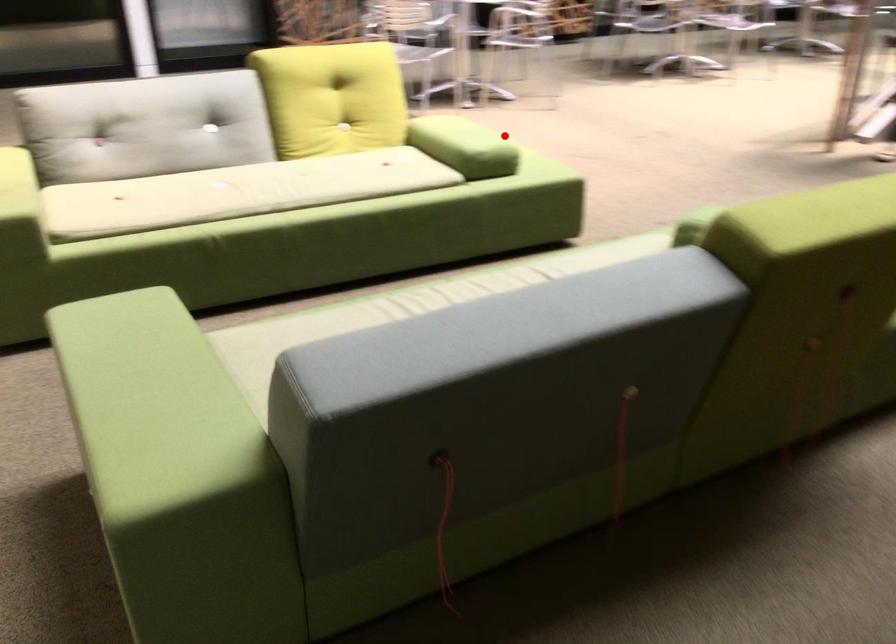
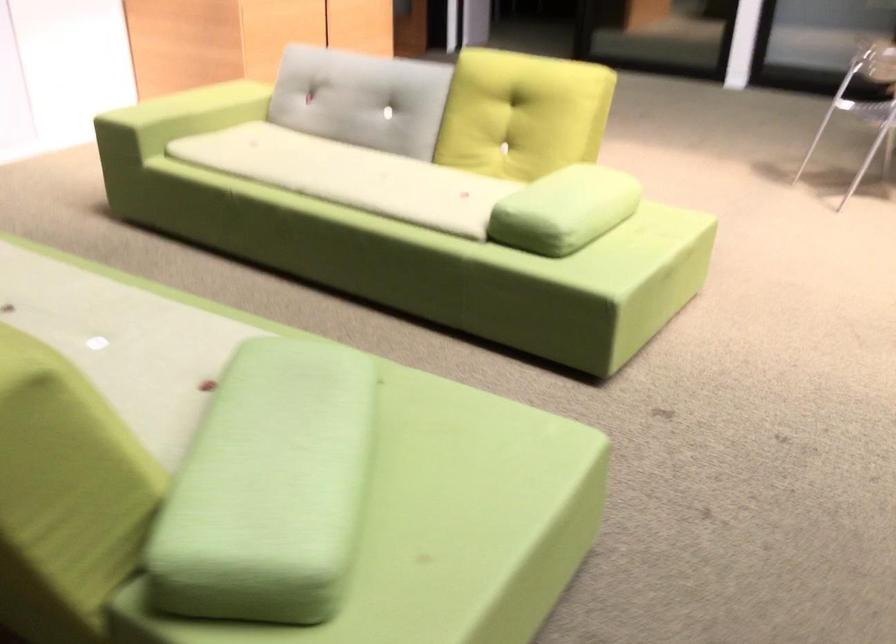
Where in the second image is the point corresponding to the highlighted location from the first image?

(564, 210)